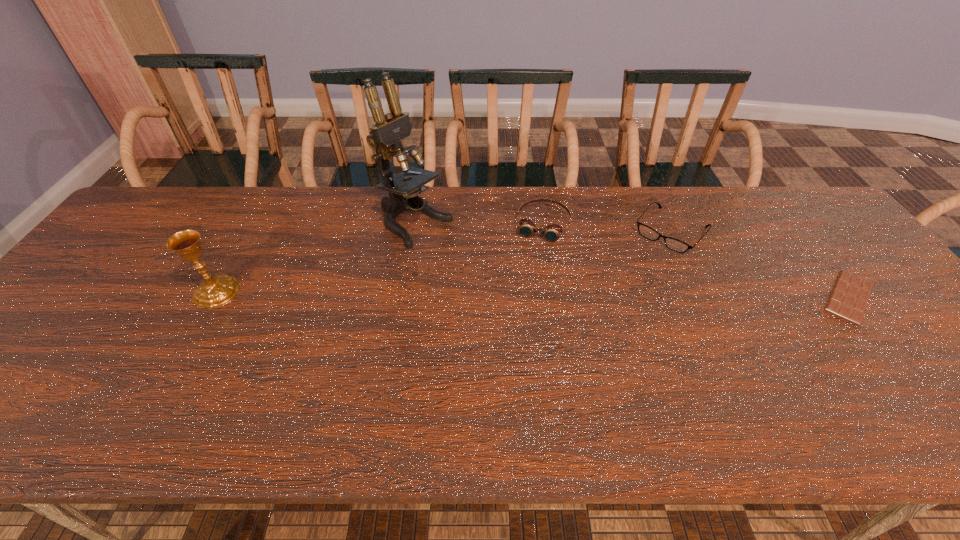
This screenshot has width=960, height=540. I want to click on free point located on the right of the second tallest object, so click(x=293, y=292).

I want to click on vacant space located 0.390m on the back of the shortest object, so coord(765,187).

Locate an element on the screen. This screenshot has height=540, width=960. vacant region located on the front-facing side of the spectacles is located at coordinates (637, 271).

Locate an element on the screen. blank area located 0.280m on the front-facing side of the spectacles is located at coordinates (605, 309).

Where is `free region located 0.370m on the front-facing side of the spectacles`? The width and height of the screenshot is (960, 540). free region located 0.370m on the front-facing side of the spectacles is located at coordinates (586, 332).

Where is `free location located at the eyepieces of the tallest object`? The height and width of the screenshot is (540, 960). free location located at the eyepieces of the tallest object is located at coordinates (554, 312).

Image resolution: width=960 pixels, height=540 pixels. I want to click on vacant region located 0.380m at the eyepieces of the tallest object, so click(547, 308).

Locate an element on the screen. This screenshot has height=540, width=960. free space located 0.070m at the eyepieces of the tallest object is located at coordinates (x=459, y=252).

This screenshot has width=960, height=540. Identify the location of free spot located through the lenses of the goggles. (507, 342).

What are the coordinates of `vacant space located 0.050m through the lenses of the goggles` in the screenshot? It's located at (534, 255).